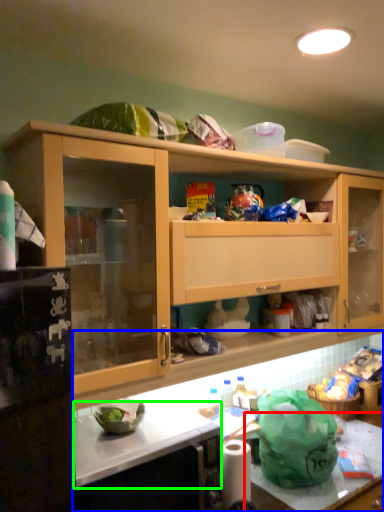
Question: Based on their relative distances, which object is farther from counter top (highlighted by a red box)? Choose from countertop (highlighted by a blue box) and counter top (highlighted by a green box).

Choices:
 (A) countertop
 (B) counter top

Answer: (B)